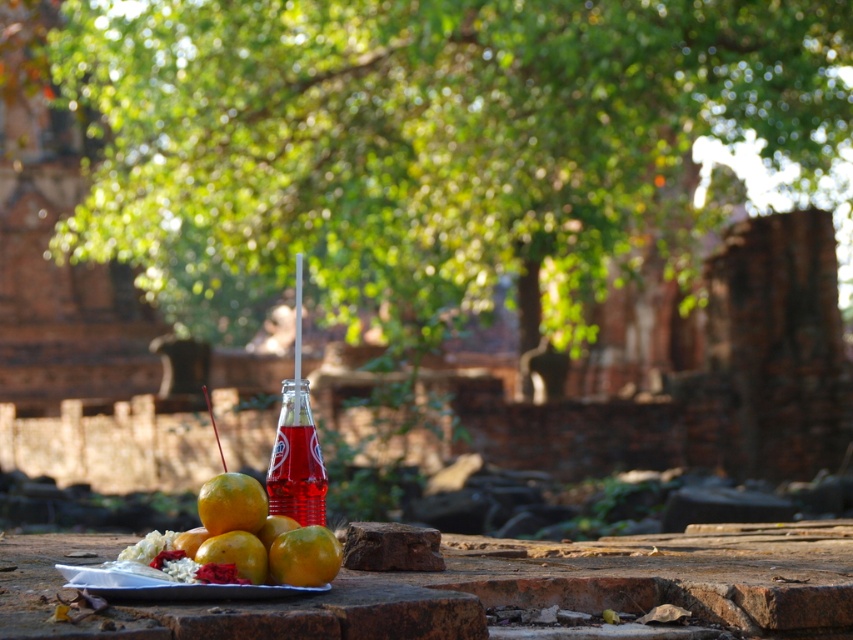
Does translucent glass bottle at center have a smaller size compared to glossy orange at center?

No.

Locate an element on the screen. translucent glass bottle at center is located at coordinates (296, 460).

What do you see at coordinates (296, 460) in the screenshot? I see `translucent glass bottle at center` at bounding box center [296, 460].

Where is `translucent glass bottle at center`? This screenshot has width=853, height=640. translucent glass bottle at center is located at coordinates (296, 460).

Can you confirm if shiny metallic plate at center is thinner than translucent glass bottle at center?

In fact, shiny metallic plate at center might be wider than translucent glass bottle at center.

Between shiny metallic plate at center and translucent glass bottle at center, which one is positioned higher?

translucent glass bottle at center is above.

Find the location of a particular element. shiny metallic plate at center is located at coordinates (254, 536).

Does glossy orange at center have a smaller size compared to shiny yellow orange at center?

Actually, glossy orange at center might be larger than shiny yellow orange at center.

Who is higher up, glossy orange at center or shiny yellow orange at center?

shiny yellow orange at center

Between point (279, 541) and point (247, 497), which one is positioned behind?

Positioned behind is point (247, 497).

Identify the location of glossy orange at center. This screenshot has height=640, width=853. tap(305, 556).